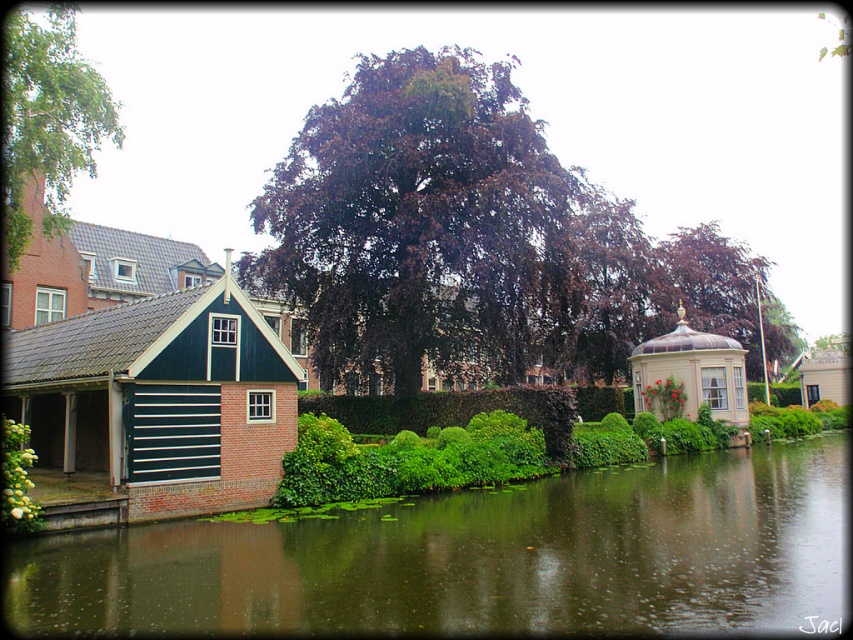
Question: Considering the relative positions of green reflective water at lower center and green leafy tree at left in the image provided, where is green reflective water at lower center located with respect to green leafy tree at left?

Choices:
 (A) left
 (B) right

Answer: (B)

Question: Does green reflective water at lower center appear under white fluffy bush at lower left?

Choices:
 (A) yes
 (B) no

Answer: (A)

Question: Which point is farther to the camera?

Choices:
 (A) (13, 518)
 (B) (76, 108)
 (C) (252, 570)
 (D) (605, 227)

Answer: (D)

Question: Which point is farther from the camera taking this photo?

Choices:
 (A) (9, 428)
 (B) (74, 74)
 (C) (294, 246)
 (D) (18, 563)

Answer: (C)

Question: Which point is closer to the camera taking this photo?

Choices:
 (A) (682, 548)
 (B) (537, 192)

Answer: (A)

Question: Observing the image, what is the correct spatial positioning of green reflective water at lower center in reference to green leafy tree at left?

Choices:
 (A) left
 (B) right

Answer: (B)